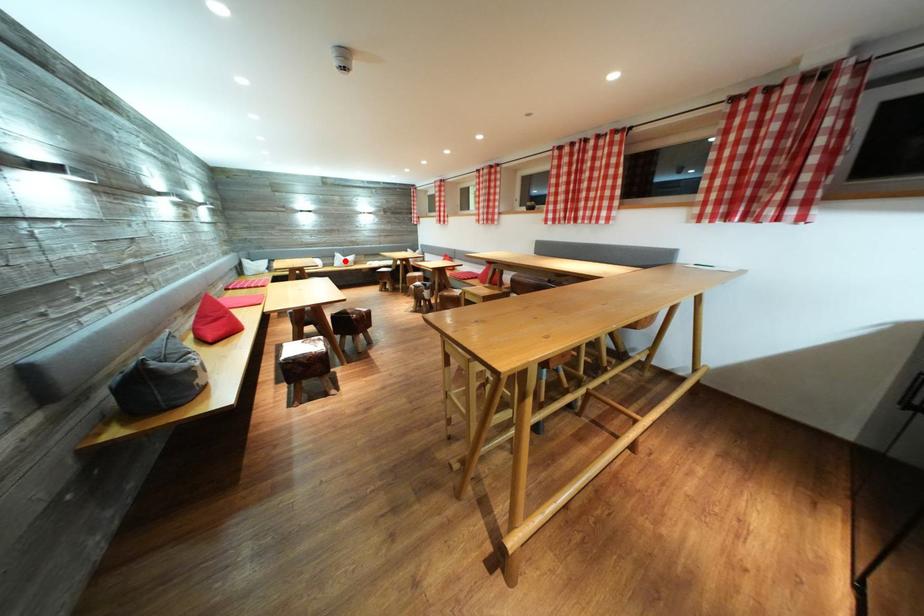
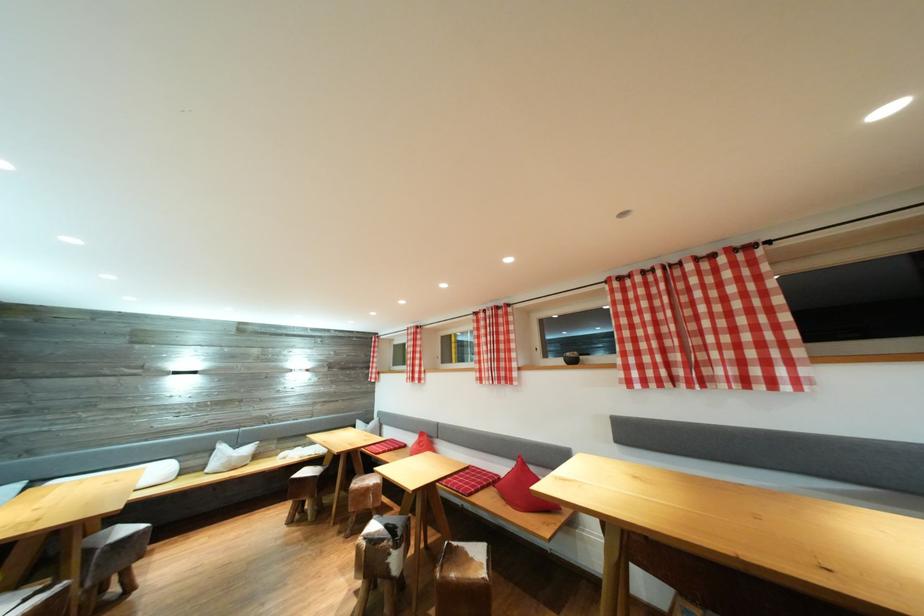
The point at the highlighted location is marked in the first image. Where is the corresponding point in the second image?

(228, 453)